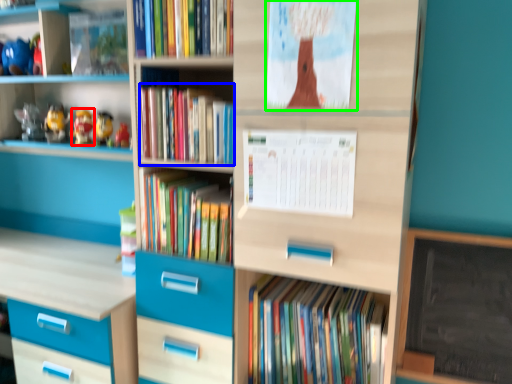
Question: Which is farther away from toy (highlighted by a red box)? book (highlighted by a blue box) or paperback book (highlighted by a green box)?

Choices:
 (A) book
 (B) paperback book

Answer: (B)